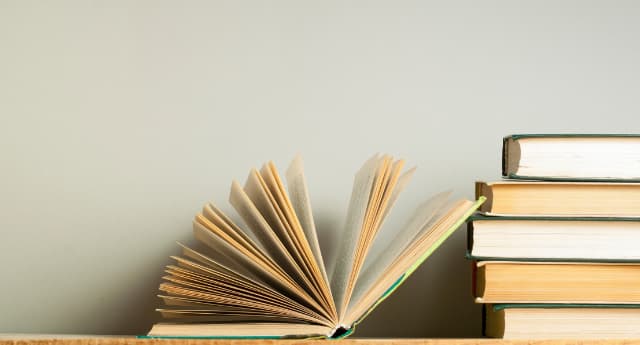
The width and height of the screenshot is (640, 345). I want to click on books, so click(x=268, y=283), click(x=543, y=317), click(x=537, y=291), click(x=525, y=236), click(x=544, y=150), click(x=541, y=199).